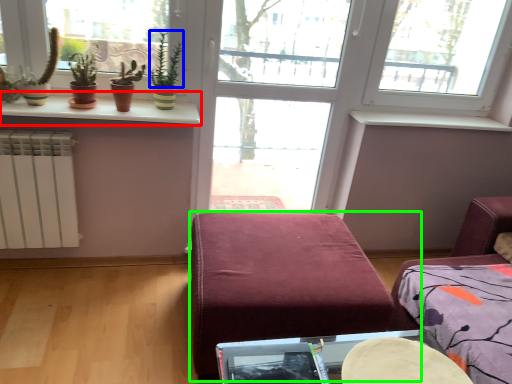
Question: Which object is positioned farthest from window sill (highlighted by a red box)? Select from plant (highlighted by a blue box) and furniture (highlighted by a green box).

Choices:
 (A) plant
 (B) furniture

Answer: (B)